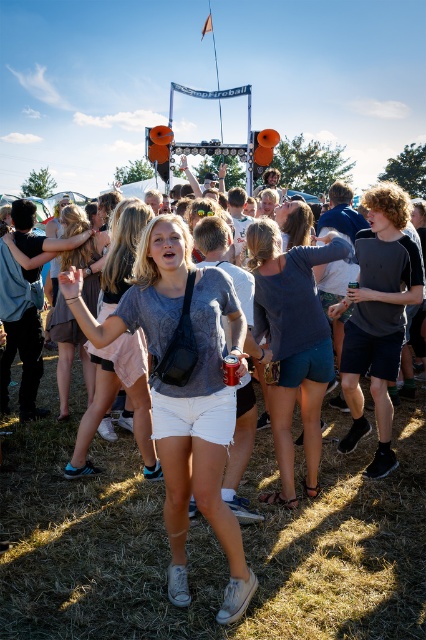
Question: In this image, where is gray cotton t-shirt at center located relative to dark gray cotton t-shirt at right?

Choices:
 (A) above
 (B) below

Answer: (B)

Question: Which object appears farthest from the camera in this image?

Choices:
 (A) dark gray cotton t-shirt at right
 (B) matte gray shirt at center
 (C) gray fabric speaker at center
 (D) gray cotton t-shirt at center

Answer: (A)

Question: Which point is farther from the camera taking this photo?

Choices:
 (A) (210, 634)
 (B) (183, 497)
 (C) (97, 404)

Answer: (C)

Question: Which object is closer to the camera taking this photo?

Choices:
 (A) dark gray cotton t-shirt at right
 (B) gray fabric speaker at center
 (C) matte gray shirt at center
 (D) dark blue denim shorts at center

Answer: (B)

Question: Considering the relative positions of gray cotton t-shirt at center and dark blue denim shorts at center in the image provided, where is gray cotton t-shirt at center located with respect to dark blue denim shorts at center?

Choices:
 (A) below
 (B) above

Answer: (A)

Question: Is gray fabric speaker at center in front of dark blue denim shorts at center?

Choices:
 (A) no
 (B) yes

Answer: (B)